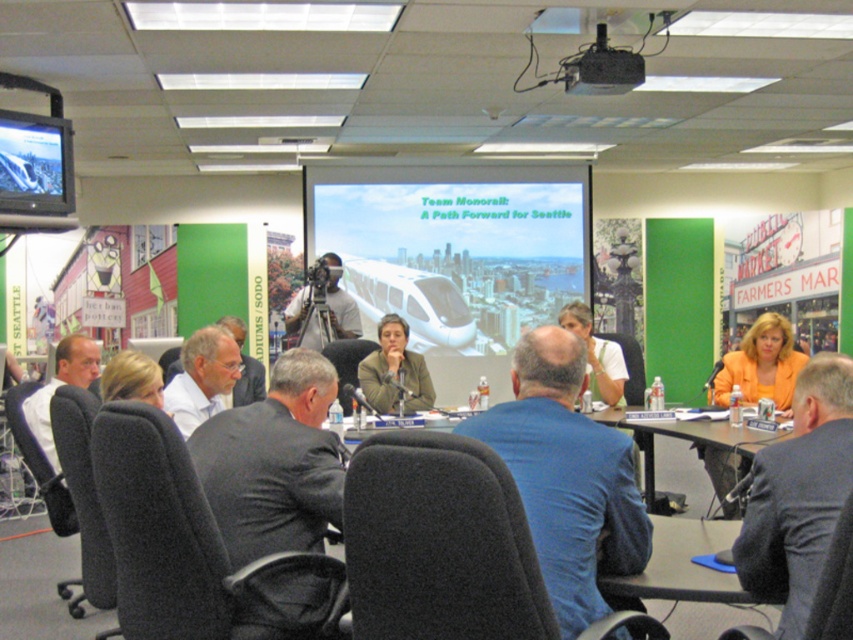
Based on the photo, is gray suit at center closer to camera compared to black plastic projector at upper center?

Yes, it is.

What do you see at coordinates (202, 378) in the screenshot?
I see `gray suit at center` at bounding box center [202, 378].

Which is behind, point (227, 368) or point (578, 61)?

The point (578, 61) is more distant.

The image size is (853, 640). Find the location of `gray suit at center`. gray suit at center is located at coordinates (202, 378).

Does gray suit at center have a lesser height compared to white shirt at left?

Yes.

Does gray suit at center appear on the right side of white shirt at left?

Indeed, gray suit at center is positioned on the right side of white shirt at left.

Describe the element at coordinates (202, 378) in the screenshot. I see `gray suit at center` at that location.

What are the coordinates of `gray suit at center` in the screenshot? It's located at coord(202,378).

Between point (413, 356) and point (300, 330), which one is positioned behind?

The point (300, 330) is behind.

Describe the element at coordinates (393, 371) in the screenshot. The height and width of the screenshot is (640, 853). I see `matte gray blazer at center` at that location.

The height and width of the screenshot is (640, 853). Identify the location of matte gray blazer at center. 393,371.

Where is `matte gray blazer at center`? This screenshot has height=640, width=853. matte gray blazer at center is located at coordinates (393, 371).